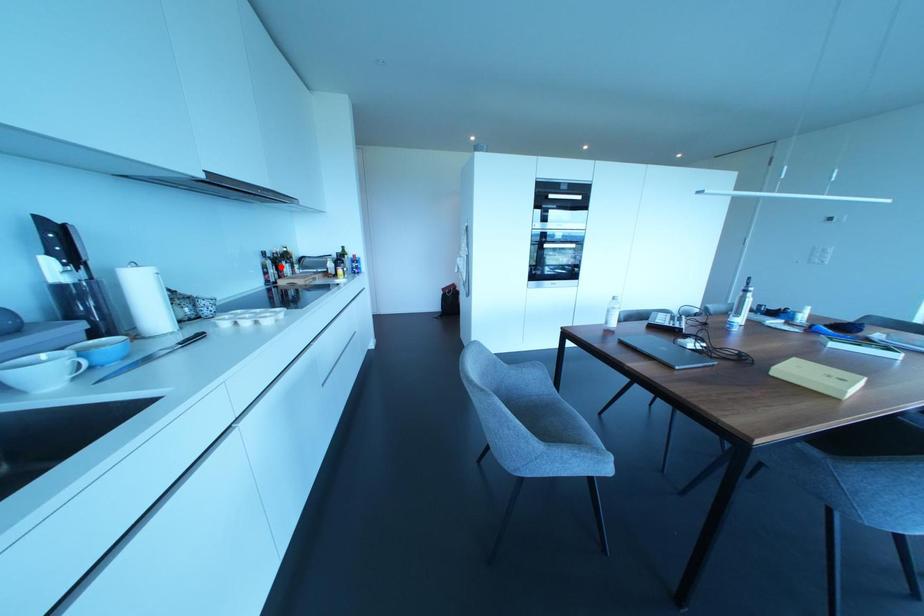
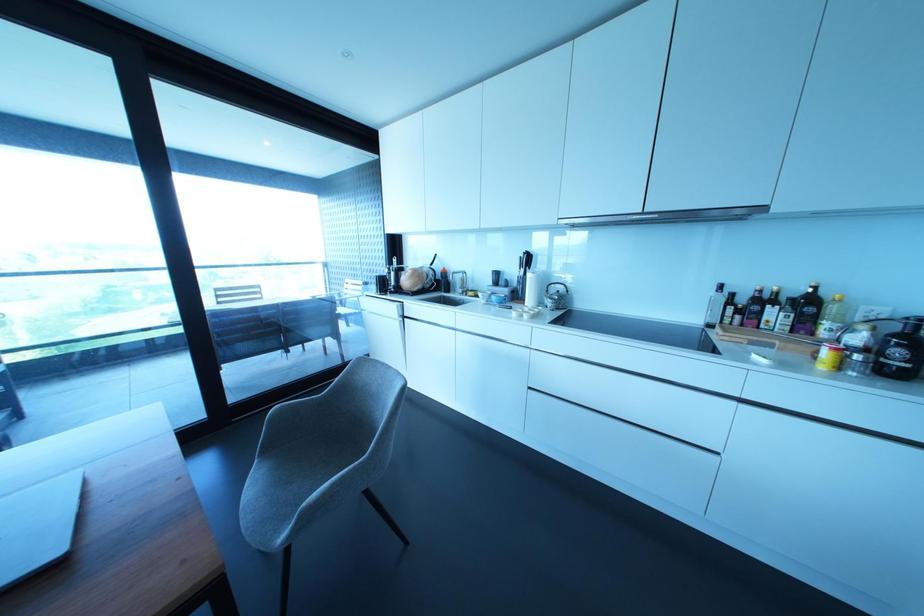
Question: I am providing you with two images of the same scene from different viewpoints. A red point is marked on the first image. At the location where the point appears in image 1, is it still visible in image 2?

Choices:
 (A) Yes
 (B) No

Answer: (A)